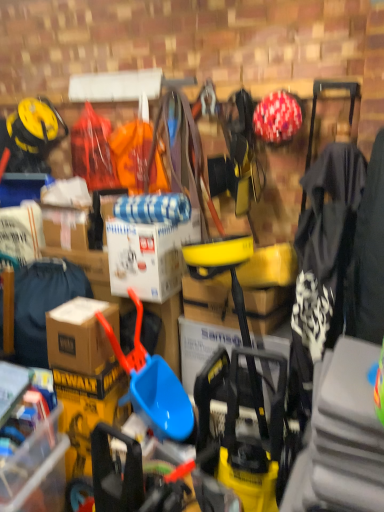
Question: Is brown cardboard box at left, which is the first clothing from back to front, turned away from brown cardboard box at lower left?

Choices:
 (A) yes
 (B) no

Answer: (B)

Question: Considering the relative sizes of brown cardboard box at left, which is counted as the 2th clothing, starting from the front, and brown cardboard box at lower left in the image provided, is brown cardboard box at left, which is counted as the 2th clothing, starting from the front, thinner than brown cardboard box at lower left?

Choices:
 (A) yes
 (B) no

Answer: (B)

Question: Can you confirm if brown cardboard box at left, the 1th clothing from the left, is positioned to the right of brown cardboard box at lower left?

Choices:
 (A) no
 (B) yes

Answer: (A)

Question: Can you confirm if brown cardboard box at left, the 1th clothing from the left, is positioned to the left of brown cardboard box at lower left?

Choices:
 (A) yes
 (B) no

Answer: (A)

Question: Is brown cardboard box at left, the 1th clothing from the left, aimed at brown cardboard box at lower left?

Choices:
 (A) no
 (B) yes

Answer: (A)

Question: Can you confirm if brown cardboard box at left, the 2th clothing in the right-to-left sequence, is shorter than brown cardboard box at lower left?

Choices:
 (A) yes
 (B) no

Answer: (B)

Question: Considering the relative sizes of white matte cardboard box at center and blue plastic shovel at center in the image provided, is white matte cardboard box at center bigger than blue plastic shovel at center?

Choices:
 (A) no
 (B) yes

Answer: (A)

Question: Is white matte cardboard box at center not inside blue plastic shovel at center?

Choices:
 (A) yes
 (B) no

Answer: (A)

Question: From the image's perspective, would you say white matte cardboard box at center is shown under blue plastic shovel at center?

Choices:
 (A) yes
 (B) no

Answer: (B)

Question: Is white matte cardboard box at center surrounding blue plastic shovel at center?

Choices:
 (A) yes
 (B) no

Answer: (B)

Question: Is white matte cardboard box at center closer to camera compared to blue plastic shovel at center?

Choices:
 (A) no
 (B) yes

Answer: (A)

Question: Does white matte cardboard box at center have a greater width compared to blue plastic shovel at center?

Choices:
 (A) yes
 (B) no

Answer: (A)

Question: Considering the relative sizes of brown cardboard box at left, which is the first clothing from back to front, and brown cardboard box at lower left in the image provided, is brown cardboard box at left, which is the first clothing from back to front, wider than brown cardboard box at lower left?

Choices:
 (A) yes
 (B) no

Answer: (B)